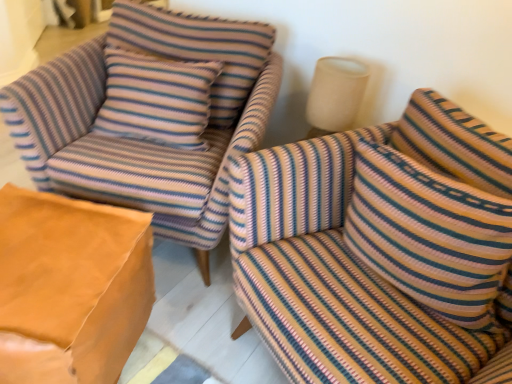
What is the approximate height of striped fabric armchair at upper left?

striped fabric armchair at upper left is 31.75 inches in height.

Find the location of a particular element. striped fabric armchair at upper left is located at coordinates (140, 140).

What do you see at coordinates (70, 287) in the screenshot? I see `leather-like tan ottoman at lower left` at bounding box center [70, 287].

I want to click on striped fabric armchair at upper left, so pos(140,140).

What's the angular difference between striped fabric armchair at upper left and leather-like tan ottoman at lower left's facing directions?

The angle between the facing direction of striped fabric armchair at upper left and the facing direction of leather-like tan ottoman at lower left is 1.87 degrees.

From a real-world perspective, is striped fabric armchair at upper left under leather-like tan ottoman at lower left?

Incorrect, from a real-world perspective, striped fabric armchair at upper left is higher than leather-like tan ottoman at lower left.

Is striped fabric armchair at upper left located outside leather-like tan ottoman at lower left?

Yes, striped fabric armchair at upper left is not within leather-like tan ottoman at lower left.

Is striped fabric armchair at upper left further to the viewer compared to leather-like tan ottoman at lower left?

Yes, striped fabric armchair at upper left is further from the camera.

Would you say leather-like tan ottoman at lower left is inside or outside striped fabric couch at right?

leather-like tan ottoman at lower left is located beyond the bounds of striped fabric couch at right.

Is leather-like tan ottoman at lower left not near striped fabric couch at right?

No, there isn't a large distance between leather-like tan ottoman at lower left and striped fabric couch at right.

Which object is closer to the camera, leather-like tan ottoman at lower left or striped fabric couch at right?

Positioned in front is striped fabric couch at right.

Is leather-like tan ottoman at lower left thinner than striped fabric couch at right?

Correct, the width of leather-like tan ottoman at lower left is less than that of striped fabric couch at right.

Is striped fabric couch at right oriented towards striped fabric armchair at upper left?

No, striped fabric couch at right does not turn towards striped fabric armchair at upper left.

From a real-world perspective, who is located higher, striped fabric couch at right or striped fabric armchair at upper left?

striped fabric couch at right is physically above.

The height and width of the screenshot is (384, 512). Identify the location of chair below the striped fabric couch at right (from a real-world perspective). (140, 140).

Which of these two, striped fabric couch at right or striped fabric armchair at upper left, is wider?

striped fabric armchair at upper left is wider.

Find the location of `studio couch below the striped fabric armchair at upper left (from the image's perspective)`. studio couch below the striped fabric armchair at upper left (from the image's perspective) is located at coordinates (380, 248).

Is striped fabric armchair at upper left bigger than striped fabric couch at right?

Correct, striped fabric armchair at upper left is larger in size than striped fabric couch at right.

Is the position of striped fabric armchair at upper left less distant than that of striped fabric couch at right?

No.

Is point (162, 176) behind point (484, 219)?

Yes, it is behind point (484, 219).

How far apart are striped fabric couch at right and striped fabric pillow at right?

striped fabric couch at right and striped fabric pillow at right are 2.86 inches apart.

Where is `pillow lying behind the striped fabric couch at right`? pillow lying behind the striped fabric couch at right is located at coordinates (430, 235).

Is striped fabric couch at right looking in the opposite direction of striped fabric pillow at right?

Yes, striped fabric couch at right's orientation is away from striped fabric pillow at right.

Is striped fabric couch at right not within striped fabric pillow at right?

Yes.

This screenshot has height=384, width=512. I want to click on chair that appears on the left of striped fabric pillow at right, so click(x=140, y=140).

Can you tell me how much striped fabric pillow at right and striped fabric armchair at upper left differ in facing direction?

There is a 32.3-degree angle between the facing directions of striped fabric pillow at right and striped fabric armchair at upper left.

Which is closer, (382, 149) or (91, 178)?

The point (382, 149) is more forward.

Is striped fabric couch at right positioned beyond the bounds of leather-like tan ottoman at lower left?

striped fabric couch at right lies outside leather-like tan ottoman at lower left's area.

Which object is positioned more to the right, striped fabric couch at right or leather-like tan ottoman at lower left?

striped fabric couch at right is more to the right.

From the image's perspective, is striped fabric couch at right above leather-like tan ottoman at lower left?

Indeed, from the image's perspective, striped fabric couch at right is shown above leather-like tan ottoman at lower left.

What's the angular difference between striped fabric couch at right and leather-like tan ottoman at lower left's facing directions?

There is a 48-degree angle between the facing directions of striped fabric couch at right and leather-like tan ottoman at lower left.

The width and height of the screenshot is (512, 384). I want to click on table on the left of striped fabric armchair at upper left, so click(70, 287).

Locate an element on the screen. The image size is (512, 384). studio couch positioned vertically above the leather-like tan ottoman at lower left (from a real-world perspective) is located at coordinates (380, 248).

From the image, which object appears to be farther from leather-like tan ottoman at lower left, striped fabric armchair at upper left or striped fabric couch at right?

striped fabric couch at right lies further to leather-like tan ottoman at lower left than the other object.

Which object lies nearer to the anchor point striped fabric couch at right, leather-like tan ottoman at lower left or striped fabric armchair at upper left?

striped fabric armchair at upper left is closer to striped fabric couch at right.

When comparing their distances from striped fabric pillow at right, does leather-like tan ottoman at lower left or striped fabric armchair at upper left seem further?

leather-like tan ottoman at lower left is positioned further to the anchor striped fabric pillow at right.

When comparing their distances from striped fabric armchair at upper left, does leather-like tan ottoman at lower left or striped fabric pillow at right seem closer?

leather-like tan ottoman at lower left lies closer to striped fabric armchair at upper left than the other object.

Which object lies further to the anchor point striped fabric pillow at right, striped fabric couch at right or leather-like tan ottoman at lower left?

The object further to striped fabric pillow at right is leather-like tan ottoman at lower left.

Considering their positions, is striped fabric armchair at upper left positioned closer to striped fabric pillow at right than leather-like tan ottoman at lower left?

Based on the image, striped fabric armchair at upper left appears to be nearer to striped fabric pillow at right.

Estimate the real-world distances between objects in this image. Which object is further from striped fabric armchair at upper left, striped fabric couch at right or leather-like tan ottoman at lower left?

striped fabric couch at right is further to striped fabric armchair at upper left.

Based on their spatial positions, is striped fabric couch at right or striped fabric armchair at upper left further from leather-like tan ottoman at lower left?

striped fabric couch at right is positioned further to the anchor leather-like tan ottoman at lower left.

Find the location of a particular element. The height and width of the screenshot is (384, 512). studio couch situated between striped fabric armchair at upper left and striped fabric pillow at right from left to right is located at coordinates pyautogui.click(x=380, y=248).

You are a GUI agent. You are given a task and a screenshot of the screen. Output one action in this format:
    pyautogui.click(x=<x>, y=<y>)
    Task: Click on the chair between leather-like tan ottoman at lower left and striped fabric couch at right from left to right
    
    Given the screenshot: What is the action you would take?
    pyautogui.click(x=140, y=140)

Identify the location of studio couch located between leather-like tan ottoman at lower left and striped fabric pillow at right in the left-right direction. Image resolution: width=512 pixels, height=384 pixels. (380, 248).

Where is `chair between leather-like tan ottoman at lower left and striped fabric pillow at right`? The width and height of the screenshot is (512, 384). chair between leather-like tan ottoman at lower left and striped fabric pillow at right is located at coordinates (140, 140).